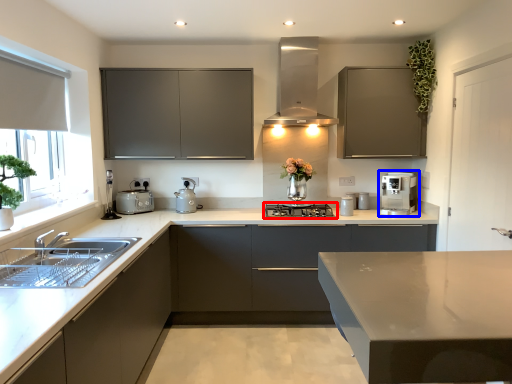
Question: Which object appears farthest to the camera in this image, home appliance (highlighted by a red box) or home appliance (highlighted by a blue box)?

Choices:
 (A) home appliance
 (B) home appliance

Answer: (B)